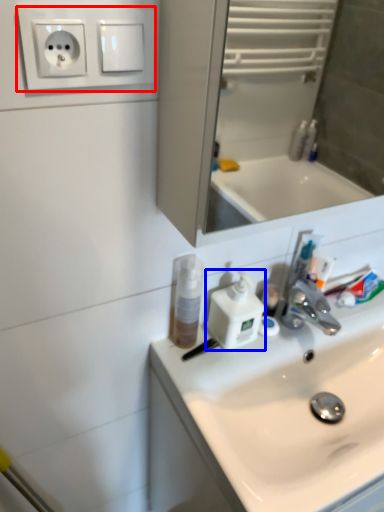
Question: Which object appears farthest to the camera in this image, electric outlet (highlighted by a red box) or soap dispenser (highlighted by a blue box)?

Choices:
 (A) electric outlet
 (B) soap dispenser

Answer: (B)